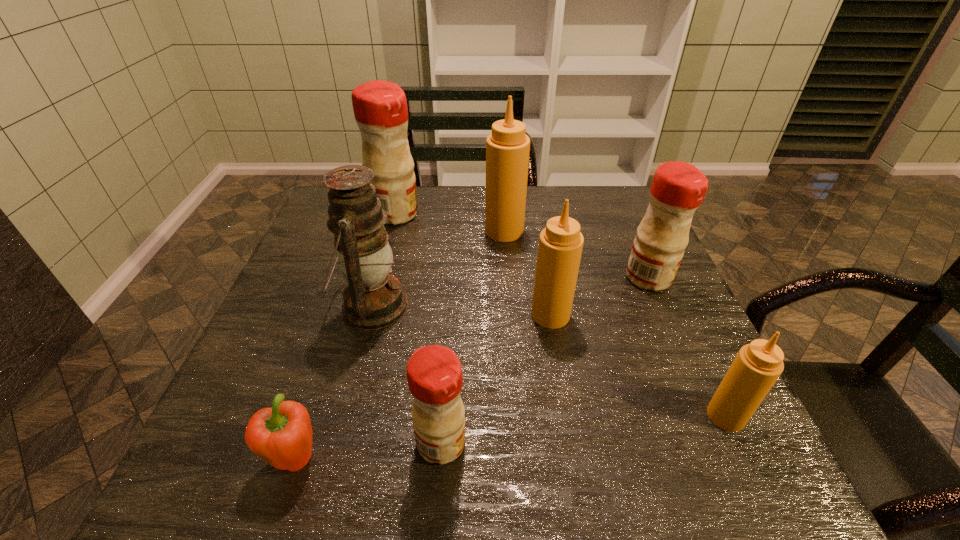
At what (x,y) coordinates should I click in order to perform the action: click on vacant space at the near edge. Please return your answer as a coordinate pair (x, y). Looking at the image, I should click on (628, 482).

Image resolution: width=960 pixels, height=540 pixels. I want to click on vacant space at the right edge of the desktop, so click(x=642, y=319).

At what (x,y) coordinates should I click in order to perform the action: click on vacant space at the far right corner of the desktop. Please return your answer as a coordinate pair (x, y). Looking at the image, I should click on (617, 195).

I want to click on vacant point located between the biggest tan condiment and the second smallest tan condiment, so click(x=527, y=273).

You are a GUI agent. You are given a task and a screenshot of the screen. Output one action in this format:
    pyautogui.click(x=<x>, y=<y>)
    Task: Click on the vacant area that lies between the farthest tan condiment and the second red condiment from left to right
    The image size is (960, 540).
    Given the screenshot: What is the action you would take?
    pyautogui.click(x=473, y=337)

Identify the location of free space between the second biggest tan condiment and the third farthest condiment. (600, 296).

In order to click on free space between the orange pepper and the lantern in this screenshot , I will do `click(333, 382)`.

Identify the location of free space that is in between the second farthest red condiment and the lantern. The width and height of the screenshot is (960, 540). [x=510, y=292].

Where is `free space that is in between the second condiment from left to right and the nearest tan condiment`? The width and height of the screenshot is (960, 540). free space that is in between the second condiment from left to right and the nearest tan condiment is located at coordinates (584, 429).

Locate which object is the third closest to the second smallest tan condiment. Please provide its 2D coordinates. Your answer should be formatted as a tuple, i.e. [(x, y)], where the tuple contains the x and y coordinates of a point satisfying the conditions above.

[(434, 373)]